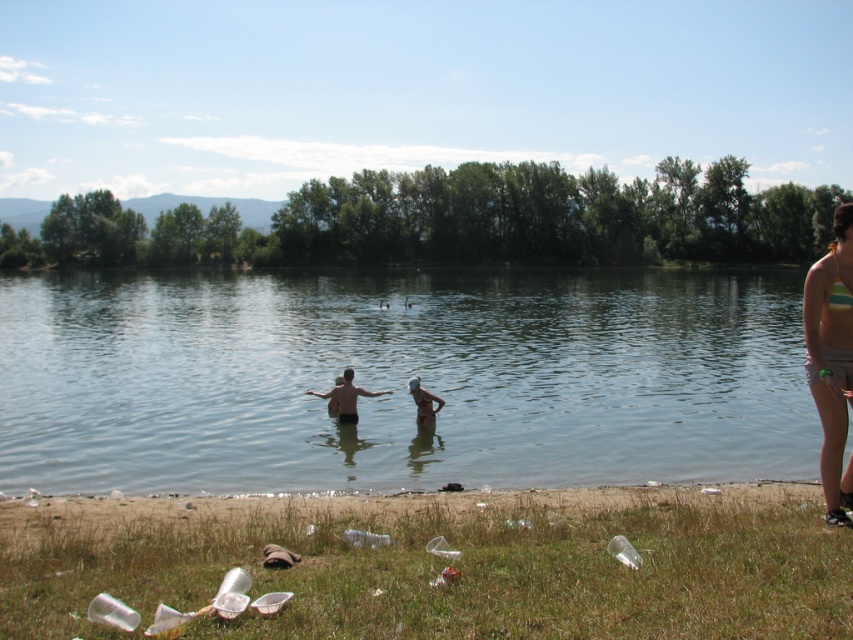
Based on the scene, which object, the clear water at center or the grassy shore at lower left, occupies more space in the image?

The clear water at center has a larger size compared to the grassy shore at lower left, so it occupies more space in the image.

You are standing on the sandy shoreline and want to locate the clear water at center. According to the coordinates provided, where should you look relative to your position?

The clear water at center is located at coordinates point [399,378], so you should look towards the center area of the image, slightly to the right and lower middle position relative to your viewpoint on the shoreline.